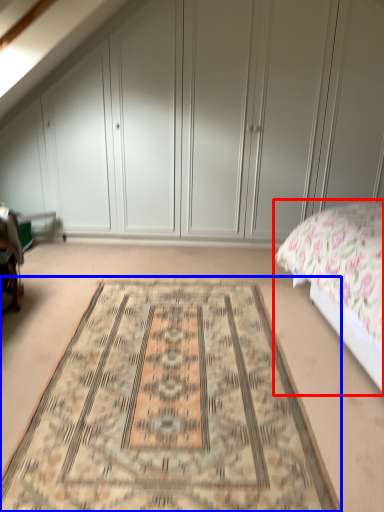
Question: Which object is closer to the camera taking this photo, bed (highlighted by a red box) or mat (highlighted by a blue box)?

Choices:
 (A) bed
 (B) mat

Answer: (A)